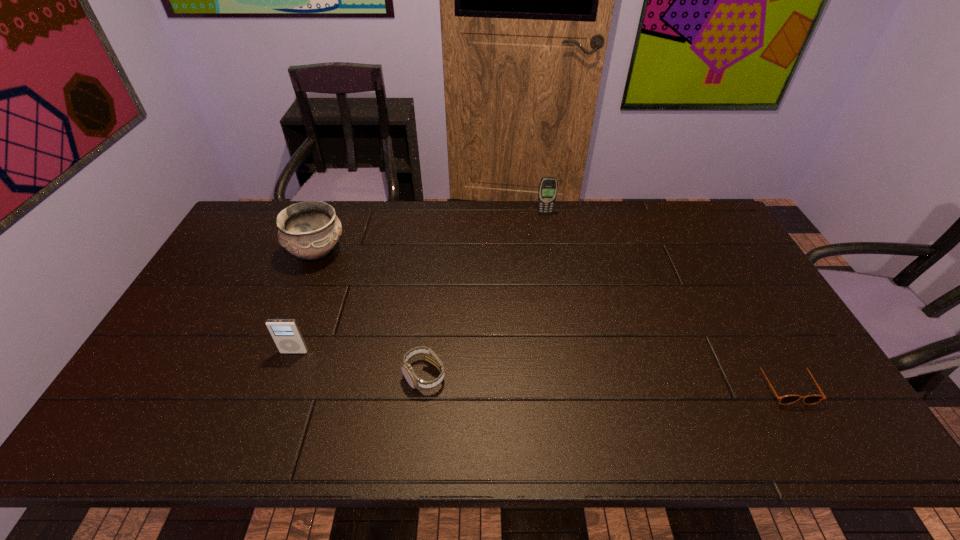
The image size is (960, 540). Identify the location of empty space between the pottery and the second shortest object. (371, 314).

Locate an element on the screen. free space between the fourth tallest object and the second farthest object is located at coordinates (371, 314).

Identify which object is located as the nearest to the third tallest object. Please provide its 2D coordinates. Your answer should be formatted as a tuple, i.e. [(x, y)], where the tuple contains the x and y coordinates of a point satisfying the conditions above.

[(414, 381)]

The height and width of the screenshot is (540, 960). I want to click on object that is the second closest to the watch, so click(x=309, y=230).